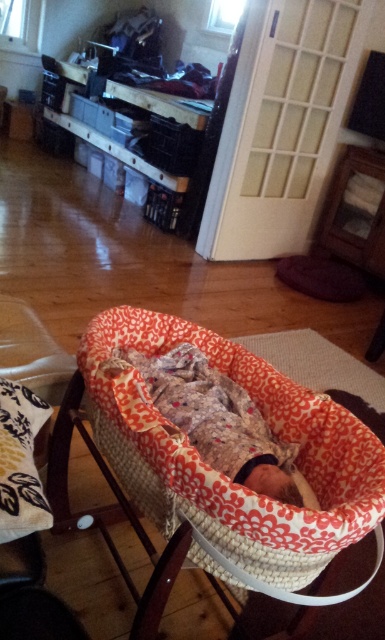
Question: Observing the image, what is the correct spatial positioning of floral fabric bassinet at center in reference to floral fabric baby at center?

Choices:
 (A) left
 (B) right

Answer: (A)

Question: Which point appears closest to the camera in this image?

Choices:
 (A) (276, 387)
 (B) (227, 436)

Answer: (B)

Question: Does floral fabric bassinet at center appear on the left side of floral fabric baby at center?

Choices:
 (A) yes
 (B) no

Answer: (A)

Question: Is floral fabric bassinet at center above floral fabric baby at center?

Choices:
 (A) yes
 (B) no

Answer: (B)